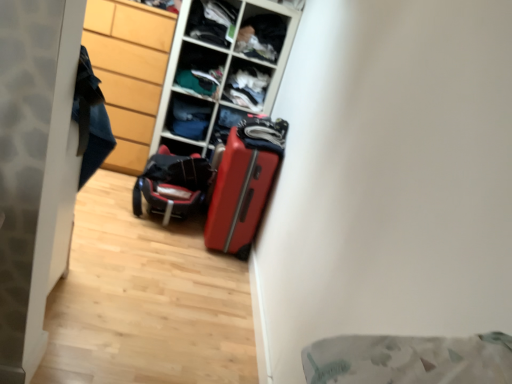
Identify the location of vacant space in front of shiny red suitcase at center. (202, 262).